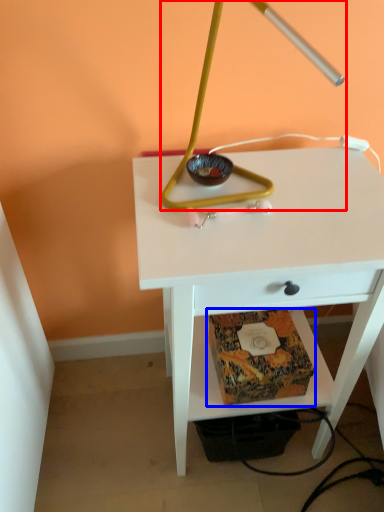
Question: Which object appears closest to the camera in this image, lamp (highlighted by a red box) or paperback book (highlighted by a blue box)?

Choices:
 (A) lamp
 (B) paperback book

Answer: (A)